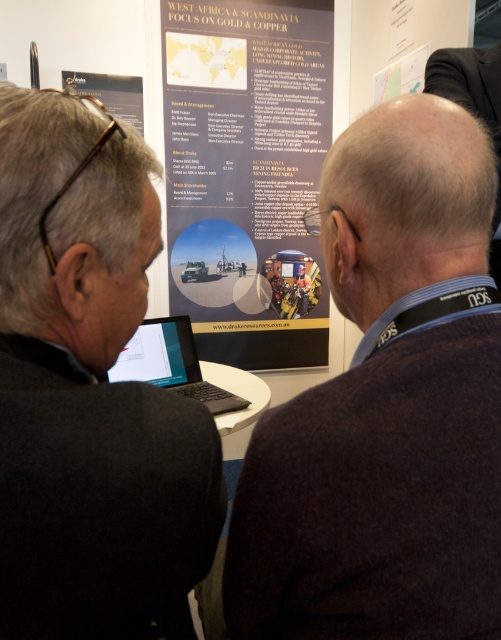
You are a photographer positioned to the side of the scene. You want to take a photo that includes both the black matte suit at left and the matte gold poster at center. Based on their positions, which object should you adjust your camera angle to ensure both are in frame?

The black matte suit at left is to the left of the matte gold poster at center. To include both in the frame, adjust your camera angle to the right to capture the black matte suit at left and the matte gold poster at center.

You are standing at the center of the image and want to reach point A at coordinates point (387, 397) and point B at coordinates point (170, 384). Which point is closer to you?

Point A at coordinates point (387, 397) is closer to you because it is in front of point B at coordinates point (170, 384).